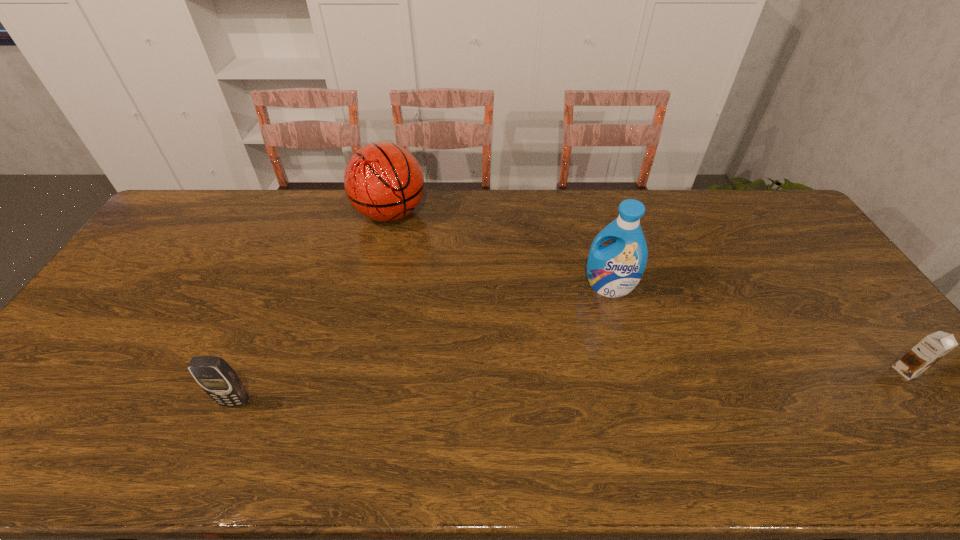
Image resolution: width=960 pixels, height=540 pixels. I want to click on blank space at the left edge, so click(x=163, y=267).

Identify the location of vacant space at the right edge of the desktop. This screenshot has width=960, height=540. (819, 253).

Locate an element on the screen. vacant area that lies between the third farthest object and the basketball is located at coordinates (648, 292).

The height and width of the screenshot is (540, 960). Identify the location of free space that is in between the third object from right to left and the detergent. (499, 251).

Where is `vacant region between the third nearest object and the cellular telephone`? Image resolution: width=960 pixels, height=540 pixels. vacant region between the third nearest object and the cellular telephone is located at coordinates (422, 345).

Identify the location of vacant area that lies between the second shortest object and the farthest object. The image size is (960, 540). (313, 308).

Locate an element on the screen. Image resolution: width=960 pixels, height=540 pixels. free space between the second nearest object and the cellular telephone is located at coordinates (570, 386).

The height and width of the screenshot is (540, 960). I want to click on free spot between the third tallest object and the third nearest object, so click(422, 345).

You are a GUI agent. You are given a task and a screenshot of the screen. Output one action in this format:
    pyautogui.click(x=<x>, y=<y>)
    Task: Click on the vacant space in between the third object from left to right and the rightmost object
    The width and height of the screenshot is (960, 540).
    Given the screenshot: What is the action you would take?
    click(757, 329)

Identify the location of free space between the rightmost object and the leftmost object. The height and width of the screenshot is (540, 960). (570, 386).